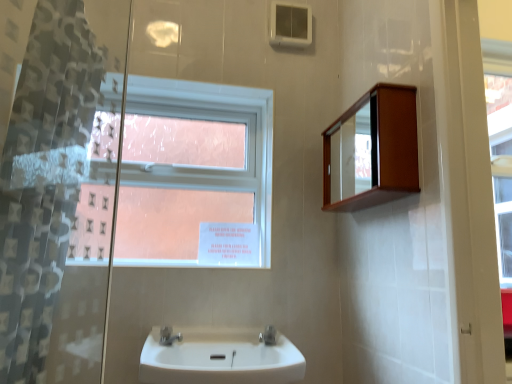
Question: Does satin nickel faucet at sink center, which is counted as the first tap, starting from the right, have a greater height compared to translucent plastic shower curtain at left?

Choices:
 (A) no
 (B) yes

Answer: (A)

Question: Is satin nickel faucet at sink center, acting as the 2th tap starting from the left, at the left side of translucent plastic shower curtain at left?

Choices:
 (A) yes
 (B) no

Answer: (B)

Question: Is satin nickel faucet at sink center, which is counted as the first tap, starting from the right, thinner than translucent plastic shower curtain at left?

Choices:
 (A) yes
 (B) no

Answer: (B)

Question: Considering the relative sizes of satin nickel faucet at sink center, acting as the 2th tap starting from the left, and translucent plastic shower curtain at left in the image provided, is satin nickel faucet at sink center, acting as the 2th tap starting from the left, wider than translucent plastic shower curtain at left?

Choices:
 (A) no
 (B) yes

Answer: (B)

Question: Is satin nickel faucet at sink center, which is counted as the first tap, starting from the right, smaller than translucent plastic shower curtain at left?

Choices:
 (A) no
 (B) yes

Answer: (B)

Question: Considering the positions of satin nickel faucet at sink center, which is counted as the first tap, starting from the right, and white glossy sink at center in the image, is satin nickel faucet at sink center, which is counted as the first tap, starting from the right, wider or thinner than white glossy sink at center?

Choices:
 (A) thin
 (B) wide

Answer: (A)

Question: From the image's perspective, relative to white glossy sink at center, is satin nickel faucet at sink center, which is counted as the first tap, starting from the right, above or below?

Choices:
 (A) below
 (B) above

Answer: (B)

Question: Considering the relative positions of satin nickel faucet at sink center, acting as the 2th tap starting from the left, and white glossy sink at center in the image provided, is satin nickel faucet at sink center, acting as the 2th tap starting from the left, to the left or to the right of white glossy sink at center?

Choices:
 (A) right
 (B) left

Answer: (A)

Question: Is point (270, 344) closer or farther from the camera than point (256, 354)?

Choices:
 (A) closer
 (B) farther

Answer: (B)

Question: From the image's perspective, is white glossy sink at center located above or below satin nickel faucet at lower center, arranged as the second tap when viewed from the right?

Choices:
 (A) below
 (B) above

Answer: (A)

Question: In the image, is white glossy sink at center on the left side or the right side of satin nickel faucet at lower center, arranged as the second tap when viewed from the right?

Choices:
 (A) left
 (B) right

Answer: (B)

Question: In terms of size, does white glossy sink at center appear bigger or smaller than satin nickel faucet at lower center, arranged as the second tap when viewed from the right?

Choices:
 (A) small
 (B) big

Answer: (B)

Question: Looking at their shapes, would you say white glossy sink at center is wider or thinner than satin nickel faucet at lower center, arranged as the second tap when viewed from the right?

Choices:
 (A) wide
 (B) thin

Answer: (A)

Question: Based on their sizes in the image, would you say white glossy sink at center is bigger or smaller than clear glass window at upper center?

Choices:
 (A) big
 (B) small

Answer: (B)

Question: From their relative heights in the image, would you say white glossy sink at center is taller or shorter than clear glass window at upper center?

Choices:
 (A) tall
 (B) short

Answer: (B)